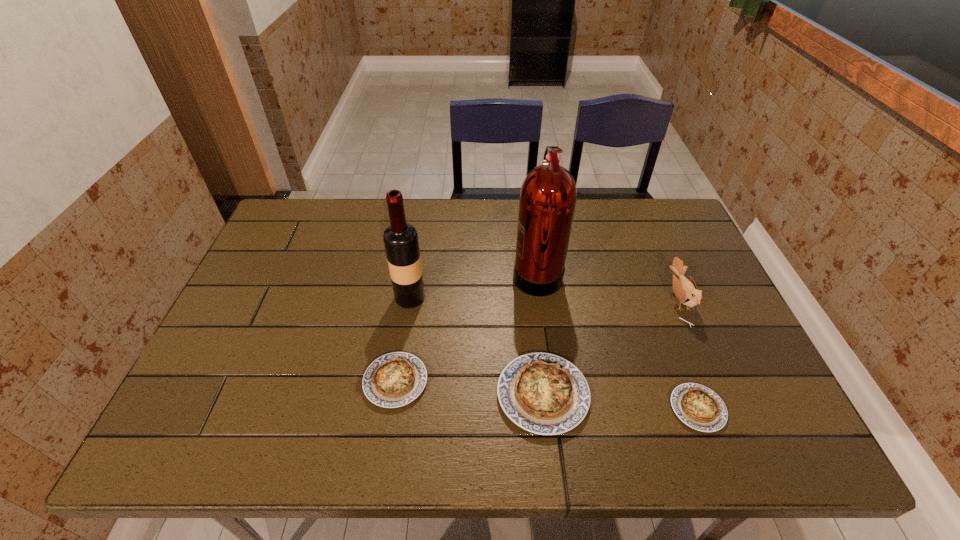
Where is `free space between the third shortest object and the second tallest quiche`? free space between the third shortest object and the second tallest quiche is located at coordinates (469, 388).

Locate an element on the screen. blank region between the fire extinguisher and the second tallest quiche is located at coordinates (467, 327).

I want to click on vacant space that's between the second tallest quiche and the tallest object, so click(467, 327).

The width and height of the screenshot is (960, 540). What are the coordinates of `unoccupied area between the tallest quiche and the second shortest object` in the screenshot? It's located at (469, 388).

Find the location of a particular element. The width and height of the screenshot is (960, 540). vacant space that is in between the wine bottle and the tallest object is located at coordinates (473, 285).

Identify the location of empty space between the third tallest object and the fire extinguisher. (608, 286).

Locate which object is the fourth closest to the wine bottle. Please provide its 2D coordinates. Your answer should be formatted as a tuple, i.e. [(x, y)], where the tuple contains the x and y coordinates of a point satisfying the conditions above.

[(699, 407)]

You are a GUI agent. You are given a task and a screenshot of the screen. Output one action in this format:
    pyautogui.click(x=<x>, y=<y>)
    Task: Click on the fourth closest object to the second tallest quiche
    This screenshot has width=960, height=540.
    Given the screenshot: What is the action you would take?
    pyautogui.click(x=699, y=407)

Where is `quiche that is the closest to the third tallest object`? quiche that is the closest to the third tallest object is located at coordinates tap(699, 407).

Identify which quiche is located as the nearest to the tallest quiche. Please provide its 2D coordinates. Your answer should be formatted as a tuple, i.e. [(x, y)], where the tuple contains the x and y coordinates of a point satisfying the conditions above.

[(395, 379)]